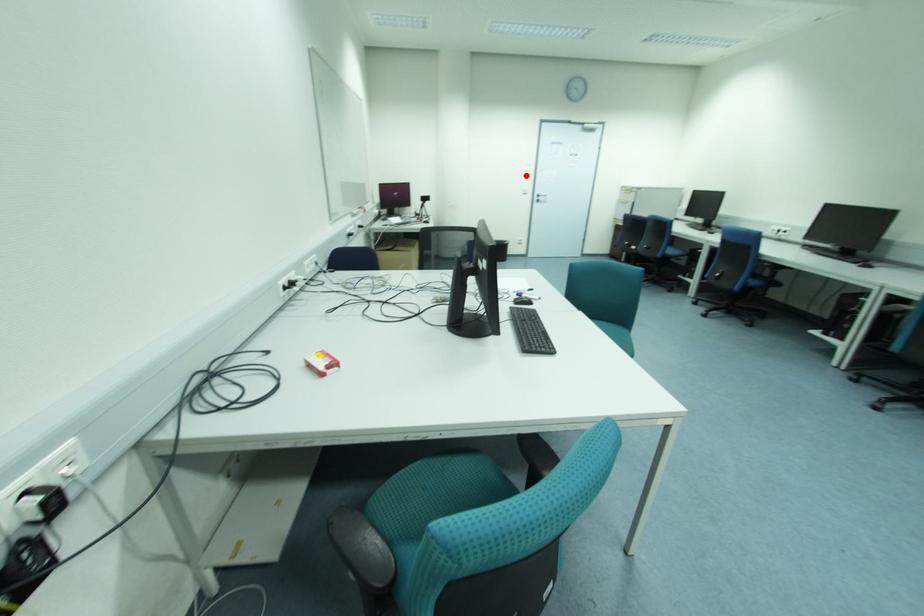
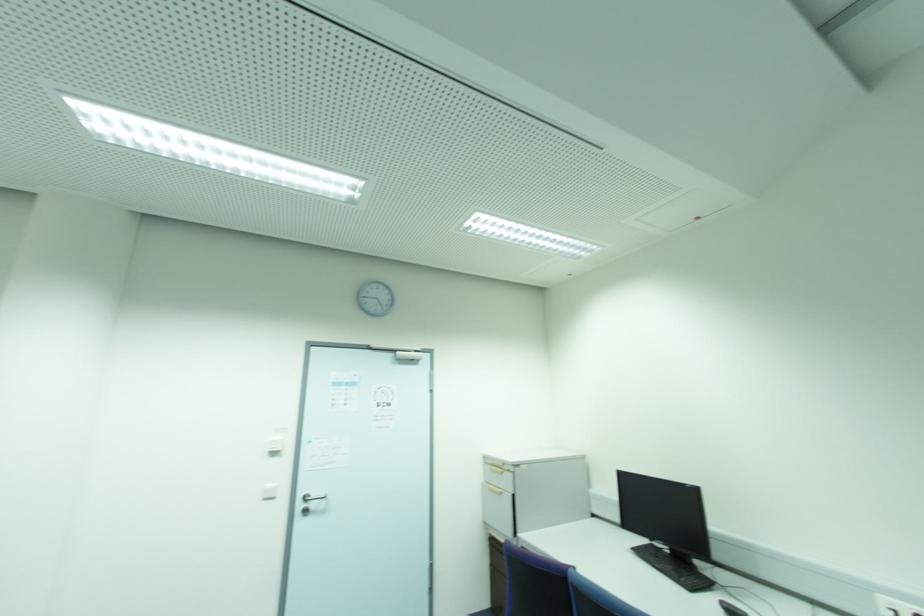
Question: I am providing you with two images of the same scene from different viewpoints. Image1 has a red point marked. In image2, the corresponding 3D location appears at what relative position? Reply with the corresponding letter.

Choices:
 (A) Closer
 (B) Farther

Answer: (B)